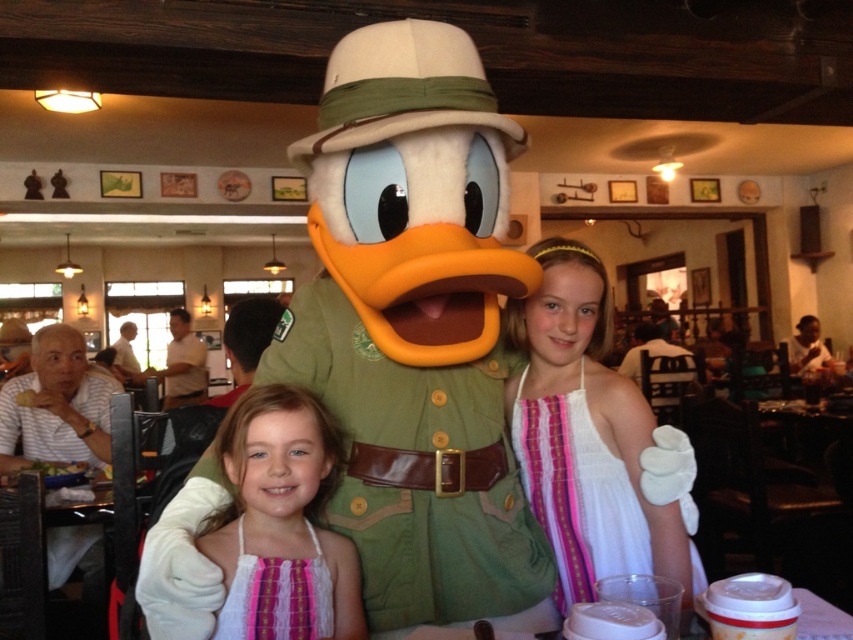
The image size is (853, 640). Describe the element at coordinates (281, 522) in the screenshot. I see `pink lace dress at center` at that location.

Is point (323, 637) positioned behind point (844, 618)?

Yes, it is behind point (844, 618).

Which is behind, point (231, 484) or point (463, 637)?

The point (231, 484) is behind.

Find the location of `pink lace dress at center`. pink lace dress at center is located at coordinates (281, 522).

Who is shorter, white sheer dress at center or pink woven dress at center?

With less height is pink woven dress at center.

Is white sheer dress at center taller than pink woven dress at center?

Indeed, white sheer dress at center has a greater height compared to pink woven dress at center.

Who is more forward, (541, 481) or (245, 636)?

Point (245, 636) is more forward.

This screenshot has height=640, width=853. Find the location of `white sheer dress at center`. white sheer dress at center is located at coordinates (595, 486).

Which of these two, white sheer dress at center or translucent plastic cups at lower center, stands taller?

With more height is white sheer dress at center.

Can you confirm if white sheer dress at center is wider than translucent plastic cups at lower center?

Correct, the width of white sheer dress at center exceeds that of translucent plastic cups at lower center.

Between point (552, 403) and point (850, 620), which one is positioned in front?

Point (850, 620) is more forward.

Image resolution: width=853 pixels, height=640 pixels. In order to click on white sheer dress at center in this screenshot , I will do `click(595, 486)`.